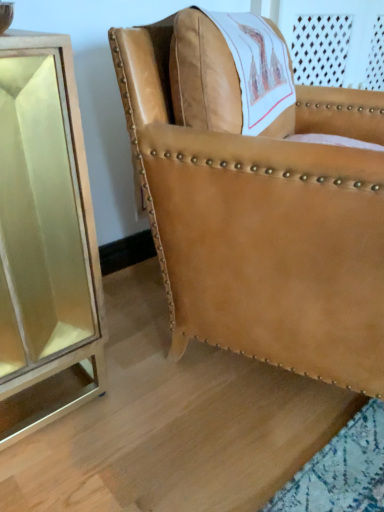
Locate an element on the screen. This screenshot has height=512, width=384. tan leather chair at center is located at coordinates (257, 207).

Image resolution: width=384 pixels, height=512 pixels. What do you see at coordinates (257, 207) in the screenshot?
I see `tan leather chair at center` at bounding box center [257, 207].

You are a GUI agent. You are given a task and a screenshot of the screen. Output one action in this format:
    pyautogui.click(x=<x>, y=<y>)
    Task: Click on the tan leather chair at center
    The width and height of the screenshot is (384, 512).
    Given the screenshot: What is the action you would take?
    pyautogui.click(x=257, y=207)